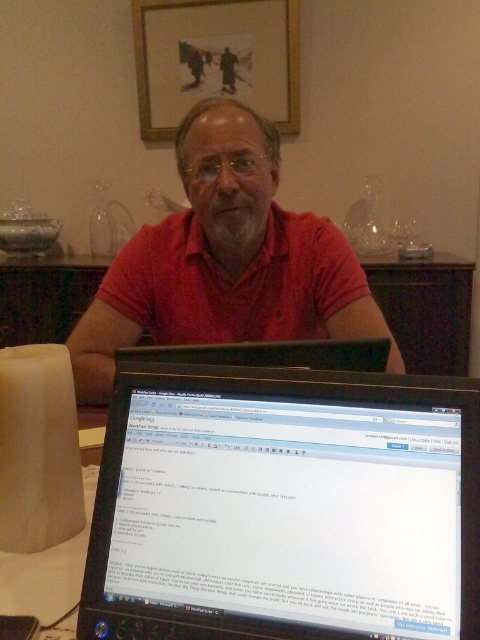
Question: Is black glossy laptop at lower center thinner than wooden framed picture at upper center?

Choices:
 (A) yes
 (B) no

Answer: (A)

Question: From the image, what is the correct spatial relationship of matte red shirt at center in relation to wooden framed picture at upper center?

Choices:
 (A) above
 (B) below

Answer: (B)

Question: Which point is closer to the camera taking this photo?

Choices:
 (A) (222, 42)
 (B) (295, 557)
 (C) (334, 305)

Answer: (B)

Question: Does black glossy laptop at lower center have a greater width compared to matte red shirt at center?

Choices:
 (A) yes
 (B) no

Answer: (B)

Question: Which point is closer to the camera?

Choices:
 (A) black glossy laptop at lower center
 (B) matte red shirt at center
 (C) wooden framed picture at upper center

Answer: (A)

Question: Which of the following is the closest to the observer?

Choices:
 (A) (298, 397)
 (B) (191, 1)
 (C) (197, 211)

Answer: (A)